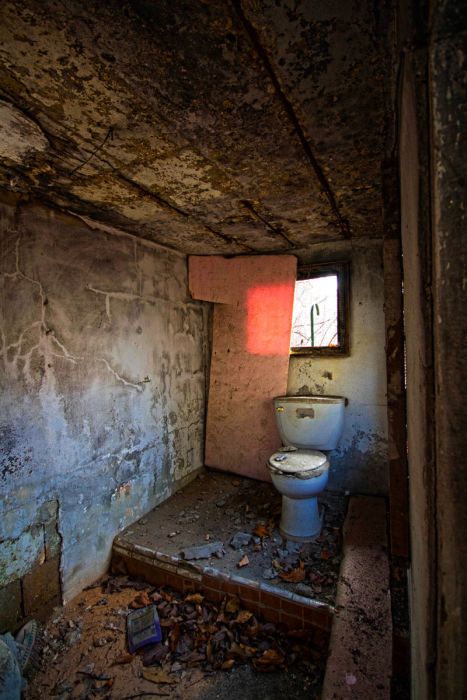
The image size is (467, 700). Identify the location of walls. (362, 402), (88, 452).